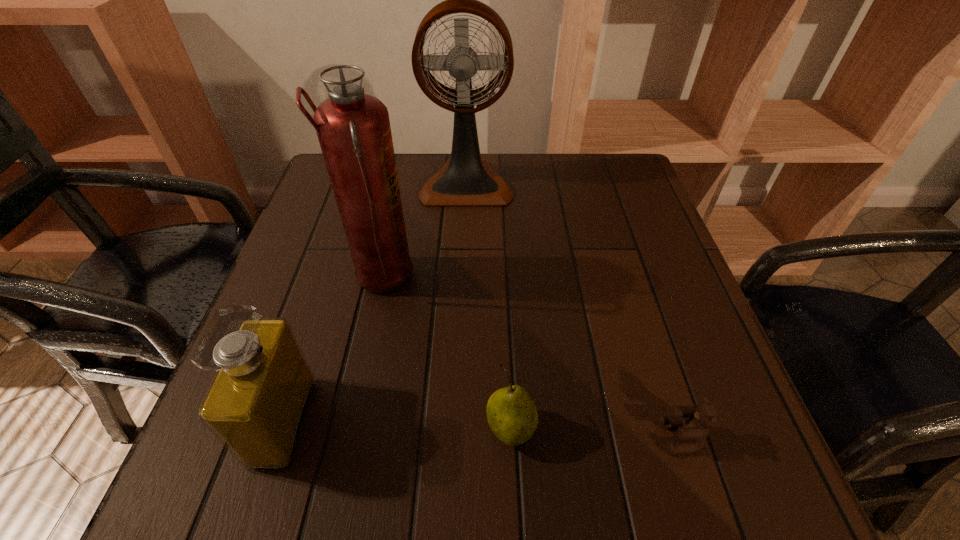
At what (x,y) coordinates should I click in order to perform the action: click on the farthest object. Please return your answer as a coordinate pair (x, y). Looking at the image, I should click on (465, 180).

In order to click on the fourth nearest object in this screenshot , I will do `click(353, 128)`.

Identify the location of the third shortest object. The width and height of the screenshot is (960, 540). (256, 404).

The width and height of the screenshot is (960, 540). Find the location of `the leftmost object`. the leftmost object is located at coordinates point(256,404).

Image resolution: width=960 pixels, height=540 pixels. In order to click on pear in this screenshot , I will do `click(512, 415)`.

The width and height of the screenshot is (960, 540). I want to click on the shortest object, so click(695, 429).

Find the location of `the rightmost object`. the rightmost object is located at coordinates (695, 429).

Identify the location of free space located on the front-facing side of the fan. (462, 306).

You are a GUI agent. You are given a task and a screenshot of the screen. Output one action in this format:
    pyautogui.click(x=<x>, y=<y>)
    Task: Click on the vacant region located on the side of the fourth nearest object with the label
    
    Given the screenshot: What is the action you would take?
    pyautogui.click(x=567, y=279)

Locate an element on the screen. free spot located 0.110m on the front-facing side of the third tallest object is located at coordinates (377, 421).